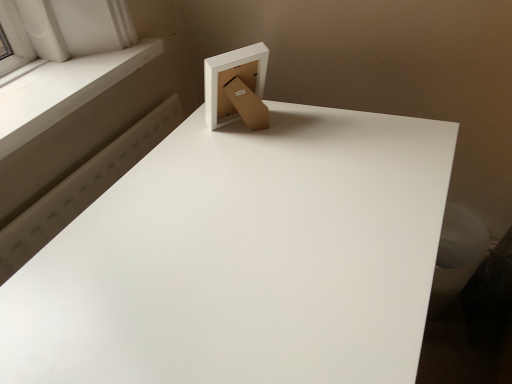
At what (x,y) coordinates should I click in order to perform the action: click on vacant area to the left of matte cardboard box at upper center. Please return your answer as a coordinate pair (x, y). The width and height of the screenshot is (512, 384). Looking at the image, I should click on (188, 152).